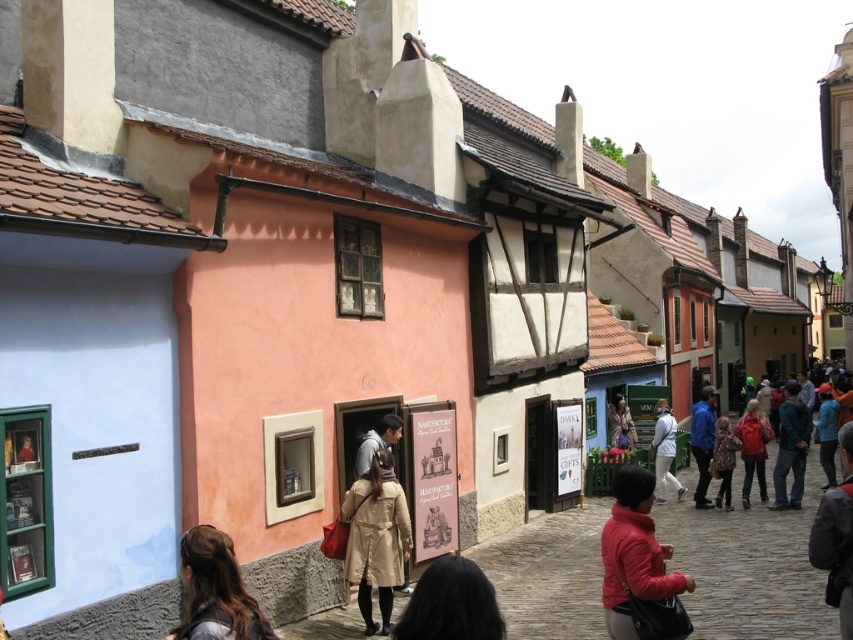
You are a tourist standing on the cobblestone street in front of the MANUFACTURA shop. You see a beige fabric trench coat at center and a brown hair at lower left. Which object is closer to you?

The beige fabric trench coat at center is closer to you than the brown hair at lower left.

You are a tailor observing the matte red jacket at lower center and the beige fabric trench coat at center in the scene. Which garment would require less fabric to make?

The matte red jacket at lower center has a smaller size compared to the beige fabric trench coat at center, so it would require less fabric to make.

You are standing on the cobblestone street in front of the MANUFACTURA shop. You notice two points marked on the ground at coordinates point (363, 564) and point (204, 534). Which point is closer to you as you face the shop?

Point (204, 534) is closer to you because it is less further to the camera than point (363, 564).